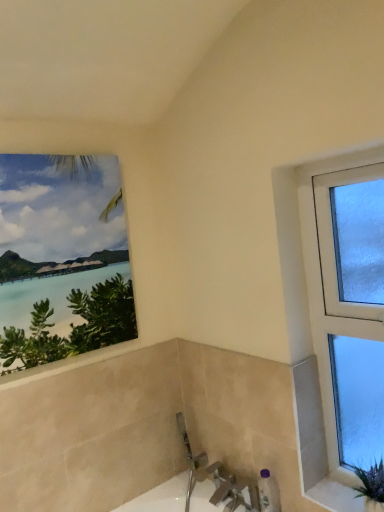
Question: Considering the relative sizes of purple plastic bottle at lower right and white textured stone at lower right in the image provided, is purple plastic bottle at lower right bigger than white textured stone at lower right?

Choices:
 (A) no
 (B) yes

Answer: (B)

Question: Is purple plastic bottle at lower right not inside white textured stone at lower right?

Choices:
 (A) no
 (B) yes

Answer: (B)

Question: Is purple plastic bottle at lower right touching white textured stone at lower right?

Choices:
 (A) no
 (B) yes

Answer: (A)

Question: Does purple plastic bottle at lower right appear on the left side of white textured stone at lower right?

Choices:
 (A) yes
 (B) no

Answer: (A)

Question: Is purple plastic bottle at lower right turned away from white textured stone at lower right?

Choices:
 (A) no
 (B) yes

Answer: (A)

Question: Do you think white glossy bath at lower center is within matte canvas painting at upper left, which is the first window from left to right, or outside of it?

Choices:
 (A) outside
 (B) inside

Answer: (A)

Question: From a real-world perspective, is white glossy bath at lower center above or below matte canvas painting at upper left, which appears as the 2th window when viewed from the right?

Choices:
 (A) above
 (B) below

Answer: (B)

Question: In terms of size, does white glossy bath at lower center appear bigger or smaller than matte canvas painting at upper left, which appears as the 2th window when viewed from the right?

Choices:
 (A) small
 (B) big

Answer: (B)

Question: In the image, is white glossy bath at lower center on the left side or the right side of matte canvas painting at upper left, which is the first window from left to right?

Choices:
 (A) left
 (B) right

Answer: (B)

Question: From a real-world perspective, relative to white glossy bath at lower center, is purple plastic bottle at lower right vertically above or below?

Choices:
 (A) below
 (B) above

Answer: (B)

Question: From their relative heights in the image, would you say purple plastic bottle at lower right is taller or shorter than white glossy bath at lower center?

Choices:
 (A) short
 (B) tall

Answer: (A)

Question: In terms of size, does purple plastic bottle at lower right appear bigger or smaller than white glossy bath at lower center?

Choices:
 (A) big
 (B) small

Answer: (B)

Question: Does point (261, 484) appear closer or farther from the camera than point (168, 488)?

Choices:
 (A) farther
 (B) closer

Answer: (B)

Question: Is white textured stone at lower right in front of or behind purple plastic bottle at lower right in the image?

Choices:
 (A) front
 (B) behind

Answer: (A)

Question: In terms of width, does white textured stone at lower right look wider or thinner when compared to purple plastic bottle at lower right?

Choices:
 (A) wide
 (B) thin

Answer: (A)